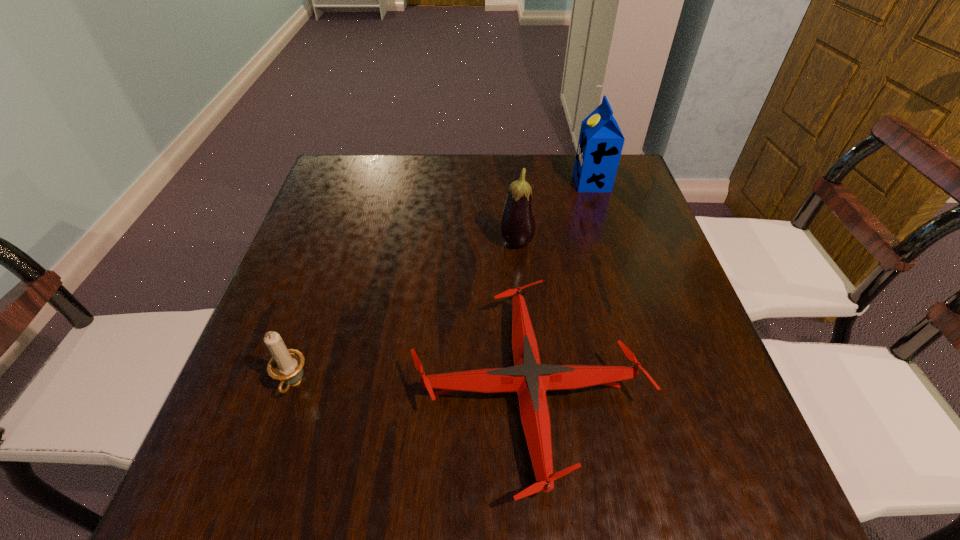
Locate an element on the screen. The height and width of the screenshot is (540, 960). blank space located on the left of the drone is located at coordinates (294, 390).

You are a GUI agent. You are given a task and a screenshot of the screen. Output one action in this format:
    pyautogui.click(x=<x>, y=<y>)
    Task: Click on the object located at the far edge
    
    Given the screenshot: What is the action you would take?
    pyautogui.click(x=600, y=144)

What are the coordinates of `object that is at the near edge` in the screenshot? It's located at (528, 377).

Image resolution: width=960 pixels, height=540 pixels. Find the location of `object positioned at the left edge`. object positioned at the left edge is located at coordinates (286, 365).

Image resolution: width=960 pixels, height=540 pixels. Identify the location of carton at the right edge. tap(600, 144).

Find the location of a particular element. drone situated at the right edge is located at coordinates (528, 377).

Find the location of a particular element. object that is positioned at the far right corner is located at coordinates (600, 144).

Locate an element on the screen. This screenshot has width=960, height=540. object that is at the near right corner is located at coordinates (528, 377).

This screenshot has width=960, height=540. I want to click on free location at the far edge of the desktop, so click(x=451, y=183).

This screenshot has height=540, width=960. I want to click on vacant space at the near edge, so click(x=623, y=512).